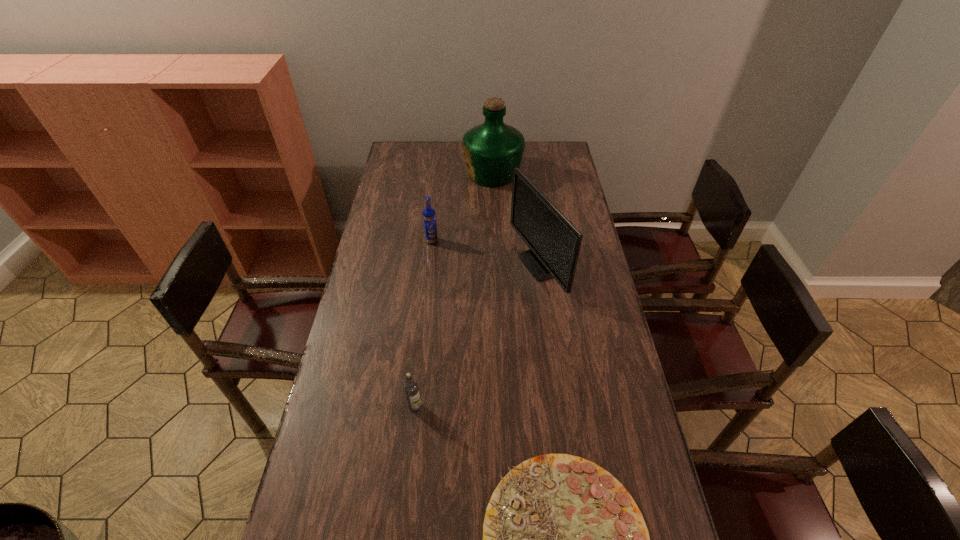
I want to click on the farthest object, so click(492, 150).

This screenshot has height=540, width=960. Find the location of `the fourth shortest object`. the fourth shortest object is located at coordinates (554, 243).

Locate an element on the screen. Image resolution: width=960 pixels, height=540 pixels. the third shortest object is located at coordinates (429, 216).

I want to click on the taller vodka, so click(429, 216).

Identify the location of the fourth farthest object. This screenshot has width=960, height=540. (411, 388).

Find the location of a particular element. the second shortest object is located at coordinates (411, 388).

Locate an element on the screen. The image size is (960, 540). vacant space situated on the label side of the liquor is located at coordinates (422, 173).

You are a GUI agent. You are given a task and a screenshot of the screen. Output one action in this format:
    pyautogui.click(x=<x>, y=<y>)
    Task: Click on the vacant region located 0.190m on the label side of the liquor
    The height and width of the screenshot is (540, 960).
    Given the screenshot: What is the action you would take?
    pyautogui.click(x=422, y=173)

Image resolution: width=960 pixels, height=540 pixels. I want to click on vacant region located on the label side of the liquor, so click(x=438, y=173).

Where is `free location located 0.370m on the front-facing side of the computer monitor`? This screenshot has height=540, width=960. free location located 0.370m on the front-facing side of the computer monitor is located at coordinates 413,265.